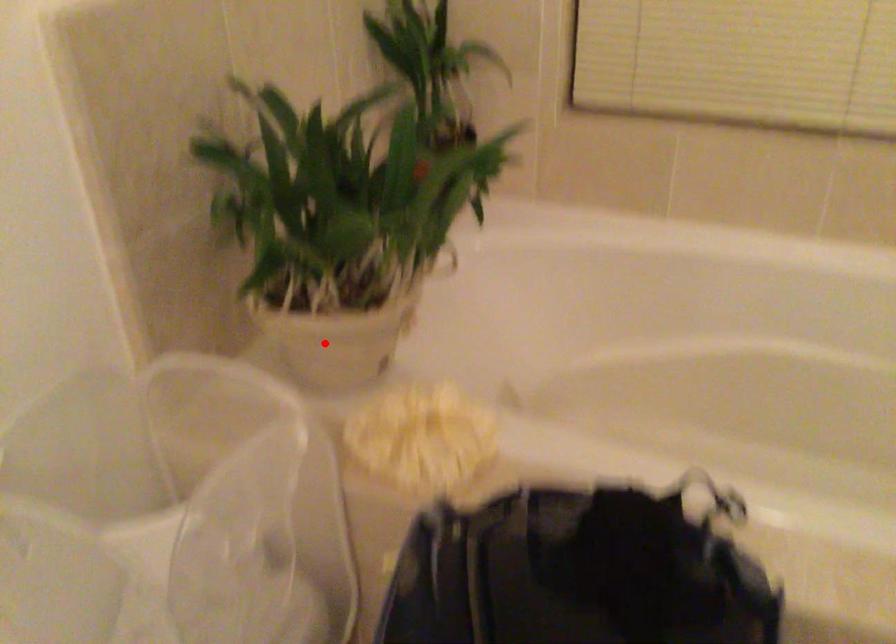
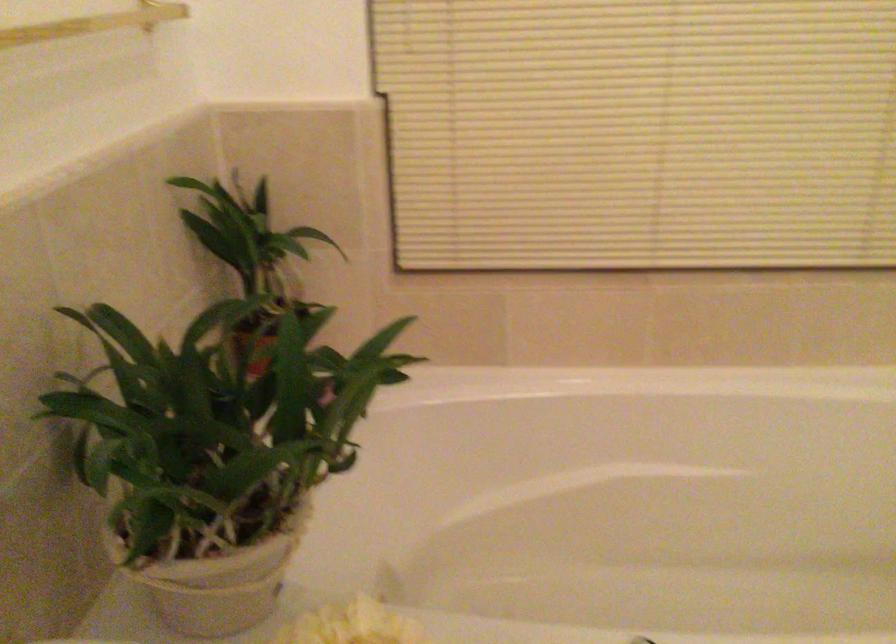
Question: I am providing you with two images of the same scene from different viewpoints. In image1, a red point is highlighted. Considering the same 3D point in image2, which of the following is correct?

Choices:
 (A) It is closer
 (B) It is farther

Answer: (A)